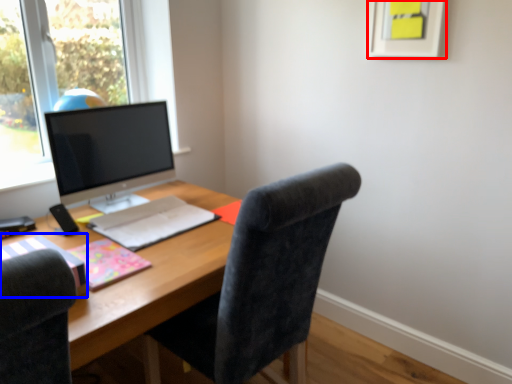
Question: Which point is further to the camera, picture frame (highlighted by a red box) or notebook (highlighted by a blue box)?

Choices:
 (A) picture frame
 (B) notebook

Answer: (A)